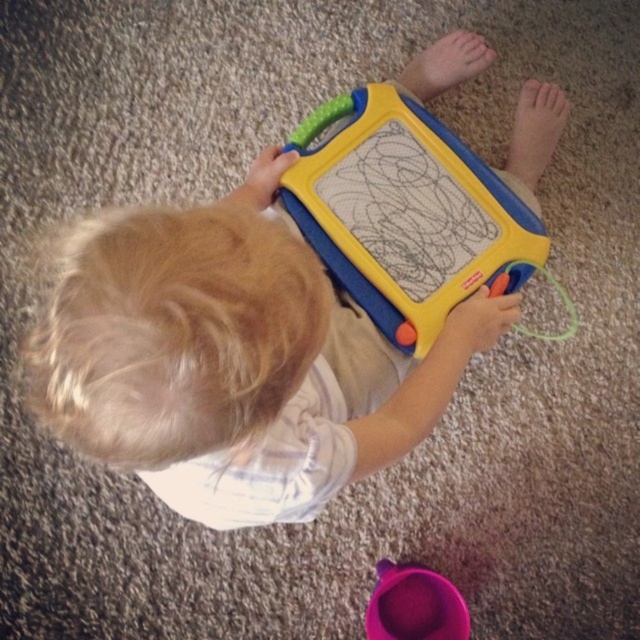
Question: Is yellow plastic toy at center to the right of yellow plastic drawing board at center from the viewer's perspective?

Choices:
 (A) yes
 (B) no

Answer: (B)

Question: Which point is farther from the camera taking this photo?

Choices:
 (A) (170, 276)
 (B) (364, 120)
 (C) (397, 596)

Answer: (C)

Question: Does yellow plastic toy at center have a smaller size compared to purple plastic cup at lower center?

Choices:
 (A) no
 (B) yes

Answer: (A)

Question: In this image, where is yellow plastic toy at center located relative to purple plastic cup at lower center?

Choices:
 (A) below
 (B) above

Answer: (B)

Question: Which of the following is the farthest from the observer?

Choices:
 (A) (472, 227)
 (B) (365, 608)

Answer: (B)

Question: Estimate the real-world distances between objects in this image. Which object is farther from the yellow plastic drawing board at center?

Choices:
 (A) yellow plastic toy at center
 (B) purple plastic cup at lower center

Answer: (B)